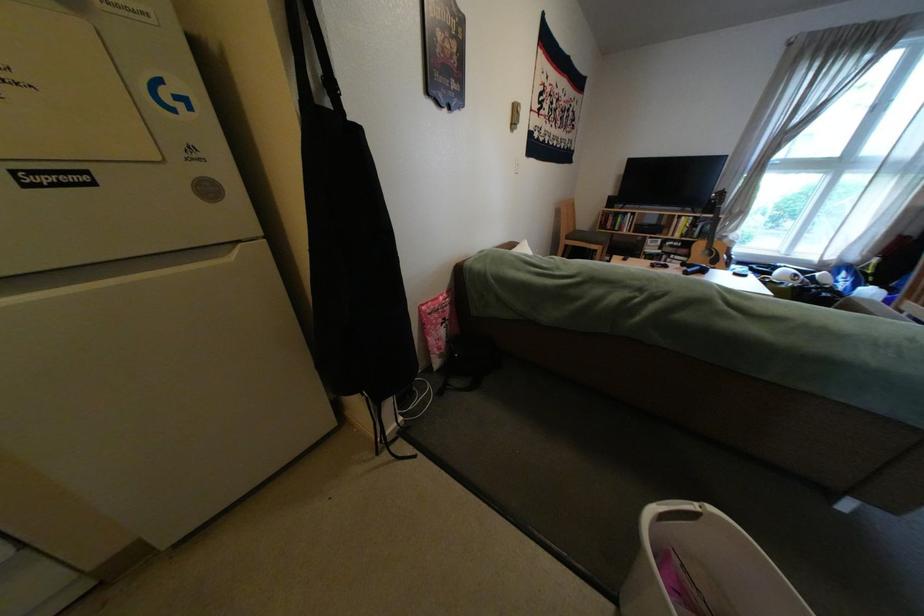
This screenshot has height=616, width=924. Identify the location of black bag strap. (311, 23).